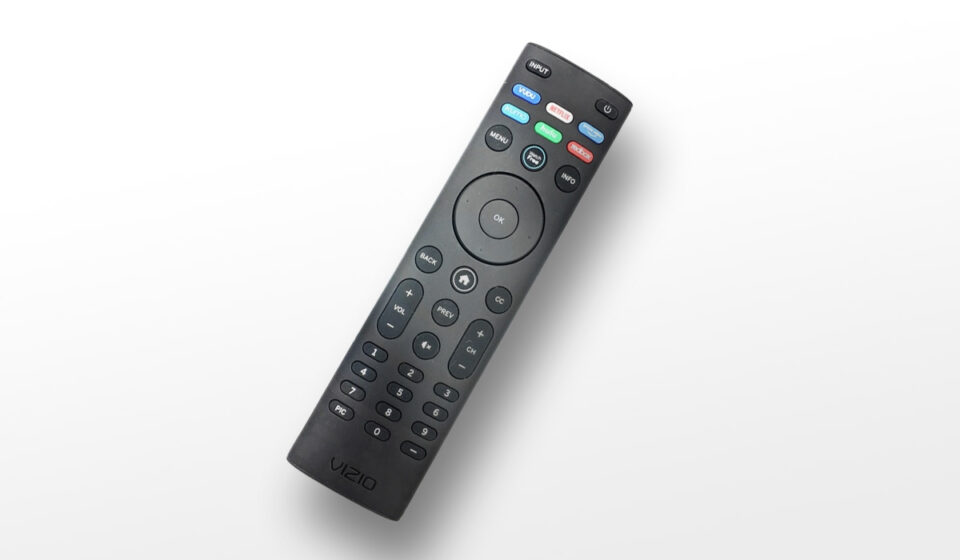
You are a GUI agent. You are given a task and a screenshot of the screen. Output one action in this format:
    pyautogui.click(x=<x>, y=<y>)
    Task: Click on the remote number buttons
    
    Given the screenshot: What is the action you would take?
    pyautogui.click(x=371, y=351), pyautogui.click(x=405, y=371), pyautogui.click(x=444, y=390), pyautogui.click(x=438, y=409), pyautogui.click(x=396, y=391), pyautogui.click(x=364, y=370), pyautogui.click(x=352, y=390), pyautogui.click(x=387, y=413), pyautogui.click(x=420, y=429), pyautogui.click(x=381, y=434)